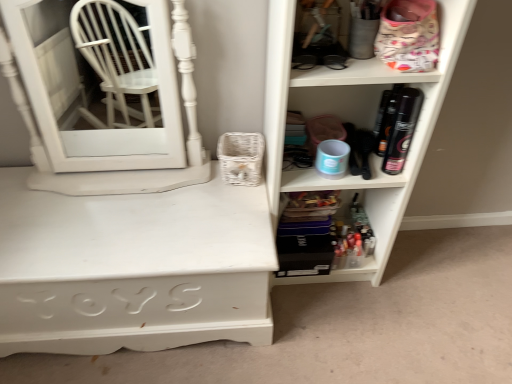
Where is `vacant area located to the right-hand side of white glossy medicine cabinet at left`? The height and width of the screenshot is (384, 512). vacant area located to the right-hand side of white glossy medicine cabinet at left is located at coordinates (216, 206).